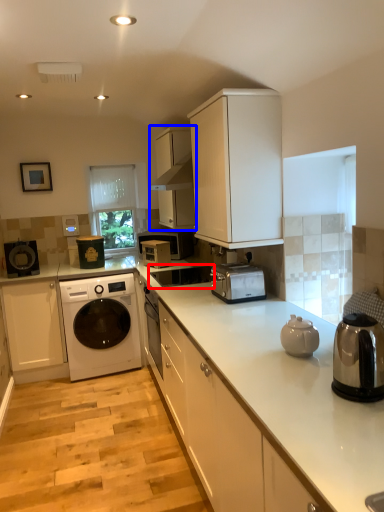
Question: Which object appears farthest to the camera in this image, sink (highlighted by a red box) or cabinetry (highlighted by a blue box)?

Choices:
 (A) sink
 (B) cabinetry

Answer: (B)